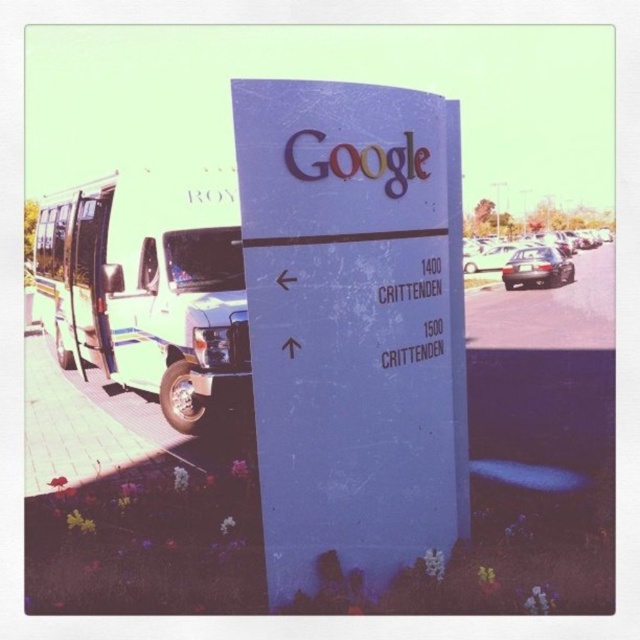
You are standing in front of the Google signboard. Can you see the white metallic van at left from this position?

Yes, the white metallic van at left is visible from the front of the Google signboard as it is positioned at point (147,288).

You are a delivery driver who needs to park your shiny silver sedan at center in a spot that is not blocked by the white matte sign at center. Based on the scene, can you park your car without the sign blocking access to the parking spot?

The white matte sign at center is smaller than the shiny silver sedan at center, so there is enough space to park the car without the sign blocking access to the parking spot.

You are a delivery driver who needs to park your shiny silver sedan at center. The white matte sign at center has a no parking zone marked on it. Can you safely park your car near the sign without violating the no parking zone?

The white matte sign at center is closer to the viewer than the shiny silver sedan at center, so parking the shiny silver sedan at center near the sign may violate the no parking zone marked on the sign. Please check the sign for specific restrictions or find an alternate parking spot.